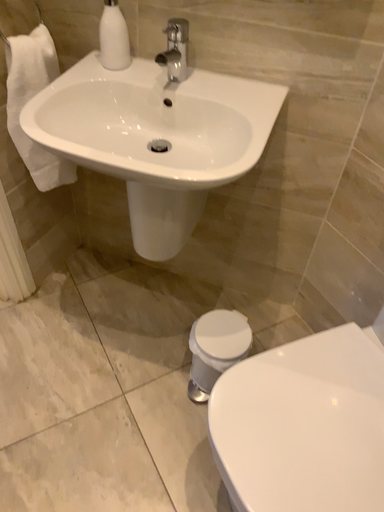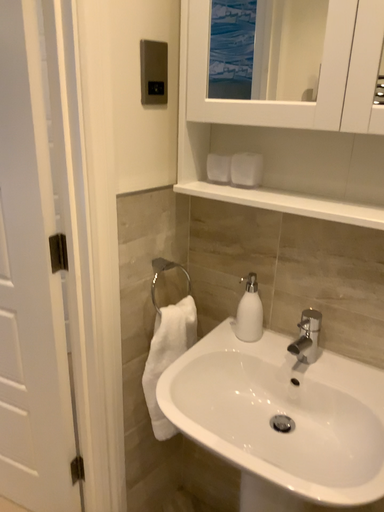
Question: Which way did the camera rotate in the video?

Choices:
 (A) rotated upward
 (B) rotated downward

Answer: (A)